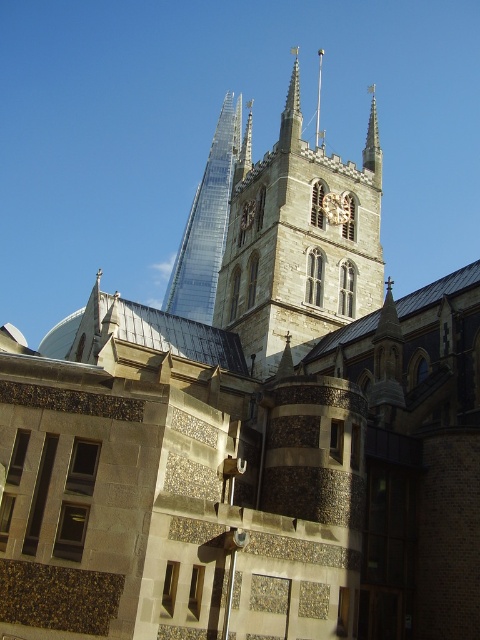
You are an architect analyzing the building in the image. You notice the transparent glass tower at upper center and the smooth glass spire at upper center. Which of these two structures is positioned closer to the viewer?

The transparent glass tower at upper center is closer to the viewer because the smooth glass spire at upper center is positioned behind it.

Based on the scene described, which object is positioned to the left when comparing the stone clock tower at center and the smooth glass spire at upper center?

The stone clock tower at center is positioned to the left of the smooth glass spire at upper center.

You are an architect designing a new building that needs to incorporate both historical and modern elements. You have two spires to choose from in the image. Which spire, the smooth stone spire at upper center or the smooth glass spire at upper center, should you select if you want a wider base for structural support?

The smooth stone spire at upper center has a larger width than the smooth glass spire at upper center, making it a better choice for a wider base and better structural support.